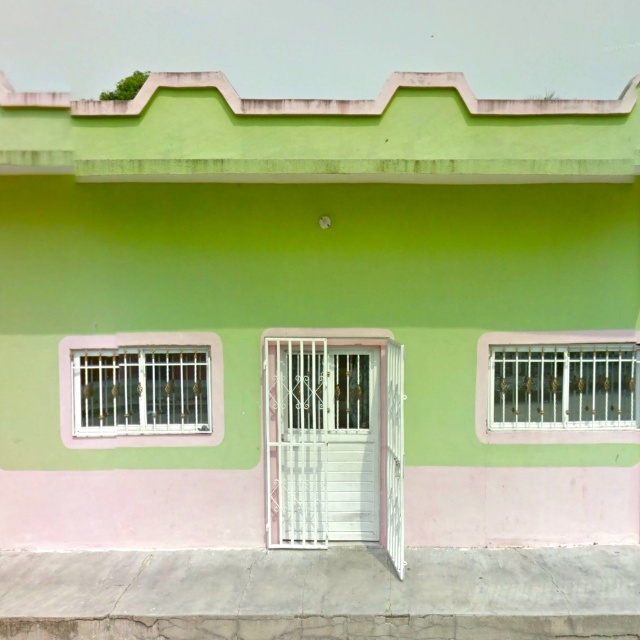
You are standing in front of the building and want to locate two specific points on its facade. The first point is at coordinates point (168,333) and the second is at point (486,384). Which point is closer to you?

Point (168,333) is in front of point (486,384), so the first point is closer to you.

You are an architect analyzing the building facade. The white metal window at left is positioned at coordinates 0.539 on the x axis and 0.220 on the y axis. If you want to place a new window symmetrically opposite to it, where would its coordinates be?

The symmetrically opposite window would be placed at coordinates approximately 0.461 on the x axis and 0.220 on the y axis, maintaining the same y position for symmetry.

You are standing in front of the building and want to hang a wreath on the window that is on the right side of the building. Which window should you choose between the white metal window at left and the white metal window at right?

The white metal window at right is the correct choice because it is positioned to the right of the white metal window at left, making it the rightmost window on the building.